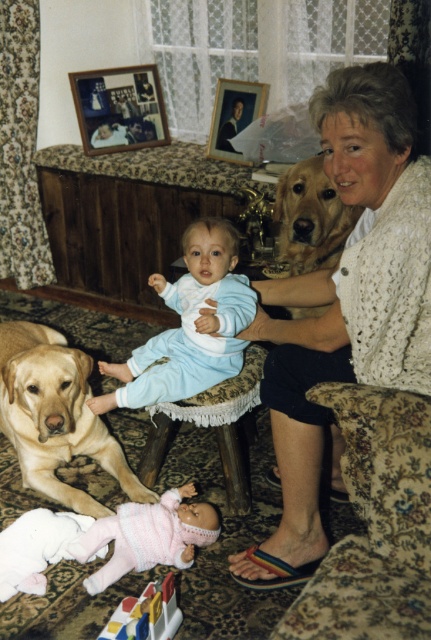
You are a guest in this living room and want to sit down. The floral fabric couch at lower center and the golden fur dog at lower left are both in your line of sight. Which object is physically smaller in size?

The floral fabric couch at lower center is smaller than the golden fur dog at lower left according to the description.

You are a photographer setting up a shoot in this living room. You need to position a light source to illuminate both the knitted pink sweater at lower center and the golden fur dog at upper right. Based on their positions, where should you place the light source to ensure both are well lit?

The knitted pink sweater at lower center is located below the golden fur dog at upper right. To illuminate both effectively, position the light source above and between them so that the light reaches both the lower and upper areas of the scene.

Based on the photo, you are a photographer standing in the living room and want to take a closeup of the two points marked in the image. Which point, point (378, 500) or point (69, 372), is closer to you?

Point (378, 500) is closer to the photographer than point (69, 372).